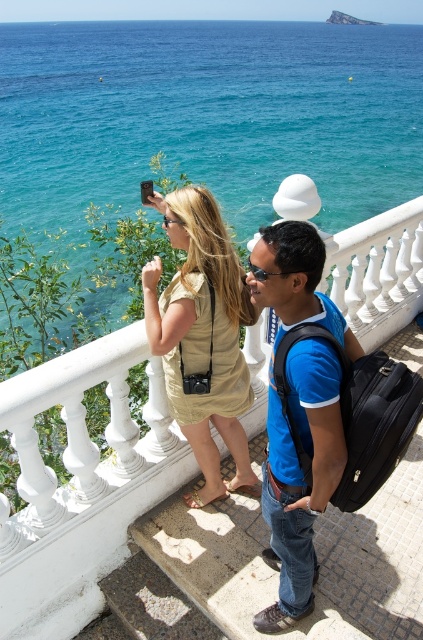
Can you confirm if matte gold dress at center is positioned below black fabric backpack at center?

No.

Is point (203, 396) behind point (280, 392)?

Yes, point (203, 396) is behind point (280, 392).

Locate an element on the screen. The height and width of the screenshot is (640, 423). matte gold dress at center is located at coordinates (203, 337).

Looking at this image, measure the distance between white marble railing at upper center and camera.

white marble railing at upper center and camera are 1.89 meters apart from each other.

Is white marble railing at upper center further to camera compared to black fabric backpack at center?

That is True.

Does point (16, 556) come closer to viewer compared to point (412, 400)?

No, it is behind (412, 400).

Find the location of a particular element. The height and width of the screenshot is (640, 423). white marble railing at upper center is located at coordinates (80, 483).

Is blue water at upper center further to camera compared to blue cotton shirt at center?

Yes, it is.

Who is lower down, blue water at upper center or blue cotton shirt at center?

blue cotton shirt at center is lower down.

Does point (337, 144) lie in front of point (286, 376)?

No, (337, 144) is further to viewer.

Locate an element on the screen. blue water at upper center is located at coordinates (208, 115).